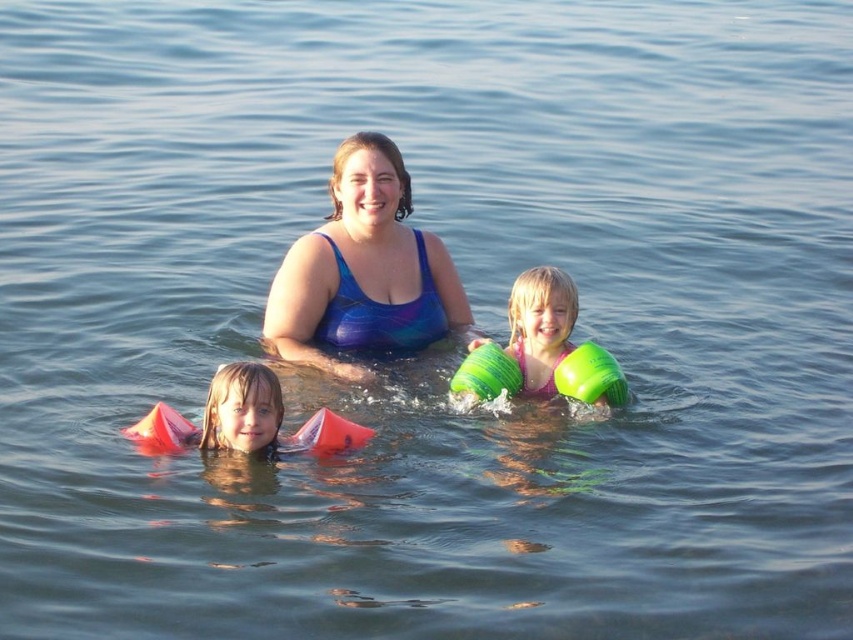
Question: Does green rubber arm bands at center have a greater width compared to matte orange floaties at lower left?

Choices:
 (A) no
 (B) yes

Answer: (B)

Question: Is green rubber arm bands at center wider than matte orange floaties at lower left?

Choices:
 (A) no
 (B) yes

Answer: (B)

Question: Which of the following is the farthest from the observer?

Choices:
 (A) green rubber arm bands at center
 (B) blue shiny swimsuit at center

Answer: (B)

Question: Is blue shiny swimsuit at center to the right of green rubber arm bands at center from the viewer's perspective?

Choices:
 (A) no
 (B) yes

Answer: (A)

Question: Which point is closer to the camera taking this photo?

Choices:
 (A) (538, 388)
 (B) (338, 324)
 (C) (271, 401)

Answer: (C)

Question: Which point is farther to the camera?

Choices:
 (A) green rubber arm bands at center
 (B) matte orange floaties at lower left
 (C) blue shiny swimsuit at center

Answer: (C)